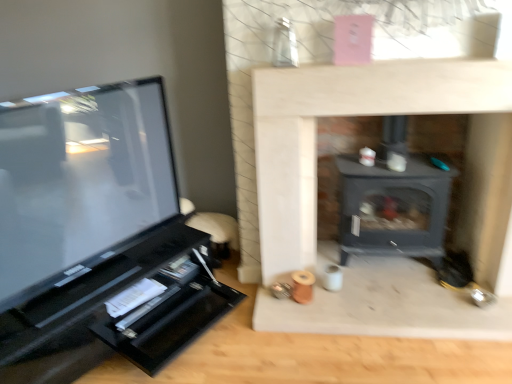
Question: From a real-world perspective, relative to matte black tv at left, is matte black wood burning stove at center vertically above or below?

Choices:
 (A) above
 (B) below

Answer: (B)

Question: In the image, is matte black wood burning stove at center on the left side or the right side of matte black tv at left?

Choices:
 (A) right
 (B) left

Answer: (A)

Question: From the image's perspective, is matte black wood burning stove at center located above or below matte black tv at left?

Choices:
 (A) below
 (B) above

Answer: (B)

Question: Is matte black tv at left wider or thinner than matte black wood burning stove at center?

Choices:
 (A) wide
 (B) thin

Answer: (B)

Question: Is matte black tv at left bigger or smaller than matte black wood burning stove at center?

Choices:
 (A) small
 (B) big

Answer: (B)

Question: Considering their positions, is matte black tv at left located in front of or behind matte black wood burning stove at center?

Choices:
 (A) front
 (B) behind

Answer: (A)

Question: Is matte black tv at left taller or shorter than matte black wood burning stove at center?

Choices:
 (A) short
 (B) tall

Answer: (A)